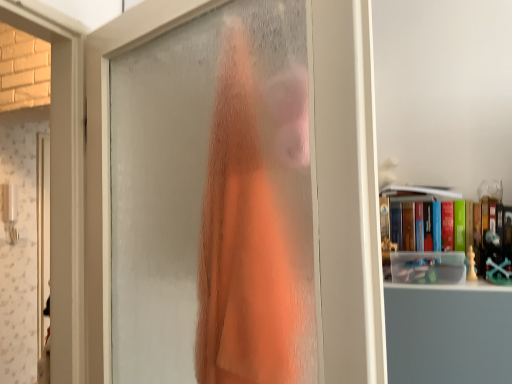
The height and width of the screenshot is (384, 512). What do you see at coordinates (423, 235) in the screenshot?
I see `hardcover book at upper right` at bounding box center [423, 235].

Identify the location of orange fabric at center. pos(245,242).

This screenshot has width=512, height=384. I want to click on frosted glass door at center, so click(346, 192).

Image resolution: width=512 pixels, height=384 pixels. I want to click on hardcover book at upper right, so click(423, 235).

Between orange fabric at center and hardcover book at upper right, which one has larger width?

hardcover book at upper right is wider.

Is point (239, 139) positioned after point (408, 270)?

No, it is not.

How distant is orange fabric at center from hardcover book at upper right?

21.45 inches.

From a real-world perspective, which object stands above the other?

orange fabric at center.

Who is shorter, frosted glass door at center or hardcover book at upper right?

Standing shorter between the two is hardcover book at upper right.

Considering the positions of objects frosted glass door at center and hardcover book at upper right in the image provided, who is in front, frosted glass door at center or hardcover book at upper right?

frosted glass door at center.

Considering the sizes of hardcover book at upper right and orange fabric at center in the image, is hardcover book at upper right wider or thinner than orange fabric at center?

hardcover book at upper right is wider than orange fabric at center.

From the image's perspective, is hardcover book at upper right on orange fabric at center?

No, from the image's perspective, hardcover book at upper right is not above orange fabric at center.

This screenshot has height=384, width=512. Identify the location of clothing on the left side of hardcover book at upper right. (245, 242).

Based on their sizes in the image, would you say orange fabric at center is bigger or smaller than frosted glass door at center?

orange fabric at center is smaller than frosted glass door at center.

How far apart are orange fabric at center and frosted glass door at center?

The distance of orange fabric at center from frosted glass door at center is 14.64 inches.

Is orange fabric at center wider or thinner than frosted glass door at center?

Considering their sizes, orange fabric at center looks slimmer than frosted glass door at center.

Does orange fabric at center have a greater height compared to frosted glass door at center?

Incorrect, the height of orange fabric at center is not larger of that of frosted glass door at center.

Is hardcover book at upper right shorter than frosted glass door at center?

Correct, hardcover book at upper right is not as tall as frosted glass door at center.

Is hardcover book at upper right beside frosted glass door at center?

hardcover book at upper right is not next to frosted glass door at center, and they're not touching.

In the scene shown: Considering their positions, is hardcover book at upper right located in front of or behind frosted glass door at center?

hardcover book at upper right is behind frosted glass door at center.

Which is more to the right, frosted glass door at center or orange fabric at center?

orange fabric at center.

Measure the distance from frosted glass door at center to orange fabric at center.

14.64 inches.

Between frosted glass door at center and orange fabric at center, which one is positioned behind?

orange fabric at center.

What's the angular difference between frosted glass door at center and orange fabric at center's facing directions?

The angular difference between frosted glass door at center and orange fabric at center is 175 degrees.

Identify the location of book below the orange fabric at center (from the image's perspective). Image resolution: width=512 pixels, height=384 pixels. (423, 235).

The width and height of the screenshot is (512, 384). I want to click on door in front of the hardcover book at upper right, so click(x=346, y=192).

Considering their positions, is orange fabric at center positioned further to frosted glass door at center than hardcover book at upper right?

Based on the image, hardcover book at upper right appears to be further to frosted glass door at center.

Estimate the real-world distances between objects in this image. Which object is closer to orange fabric at center, hardcover book at upper right or frosted glass door at center?

frosted glass door at center is closer to orange fabric at center.

From the picture: Which object lies further to the anchor point hardcover book at upper right, orange fabric at center or frosted glass door at center?

frosted glass door at center lies further to hardcover book at upper right than the other object.

Based on their spatial positions, is frosted glass door at center or orange fabric at center closer to hardcover book at upper right?

orange fabric at center.

Which object lies nearer to the anchor point frosted glass door at center, hardcover book at upper right or orange fabric at center?

Based on the image, orange fabric at center appears to be nearer to frosted glass door at center.

Looking at the image, which one is located further to orange fabric at center, frosted glass door at center or hardcover book at upper right?

Based on the image, hardcover book at upper right appears to be further to orange fabric at center.

What are the coordinates of `clothing between frosted glass door at center and hardcover book at upper right in the horizontal direction` in the screenshot? It's located at (245, 242).